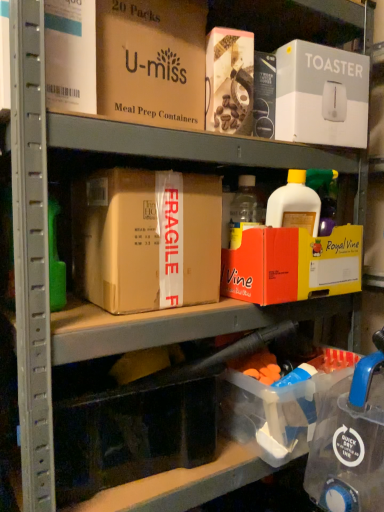
Question: Does point (81, 432) appear closer or farther from the camera than point (334, 375)?

Choices:
 (A) closer
 (B) farther

Answer: (A)

Question: In terms of width, does transparent plastic storage box at lower center, which ranks as the second storage box in right-to-left order, look wider or thinner when compared to clear plastic storage box at lower right, which is counted as the 1th storage box, starting from the right?

Choices:
 (A) wide
 (B) thin

Answer: (B)

Question: Which object is the closest to the white cardboard toaster at upper right, the second box in the top-to-bottom sequence?

Choices:
 (A) brown cardboard box at upper center, which is the first box from top to bottom
 (B) clear plastic storage box at lower right, the second storage box positioned from the left
 (C) transparent plastic storage box at lower center, which ranks as the 1th storage box in left-to-right order
 (D) orange cardboard box at upper center, placed as the first box when sorted from bottom to top
 (E) brown cardboard box at center, the third box positioned from the top

Answer: (A)

Question: Estimate the real-world distances between objects in this image. Which object is farther from the brown cardboard box at center, marked as the second box in a bottom-to-top arrangement?

Choices:
 (A) white cardboard toaster at upper right, the 3th box positioned from the bottom
 (B) transparent plastic storage box at lower center, which ranks as the 1th storage box in left-to-right order
 (C) orange cardboard box at upper center, the fourth box viewed from the top
 (D) clear plastic storage box at lower right, the second storage box positioned from the left
 (E) brown cardboard box at upper center, which is the first box from top to bottom

Answer: (A)